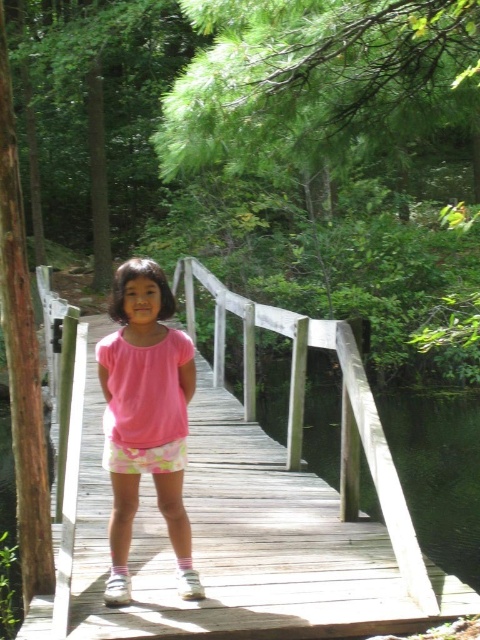
Question: In this image, where is wooden bridge at center located relative to transparent water at bridge right?

Choices:
 (A) right
 (B) left

Answer: (B)

Question: Which point is closer to the camera?

Choices:
 (A) transparent water at bridge right
 (B) pink cotton shirt at center

Answer: (B)

Question: Which point is closer to the camera?

Choices:
 (A) pink cotton shirt at center
 (B) wooden bridge at center
 (C) transparent water at bridge right

Answer: (B)

Question: Where is wooden bridge at center located in relation to pink cotton shirt at center in the image?

Choices:
 (A) below
 (B) above

Answer: (A)

Question: Which of the following is the farthest from the observer?

Choices:
 (A) wooden bridge at center
 (B) pink cotton shirt at center

Answer: (B)

Question: Does transparent water at bridge right appear over pink cotton shirt at center?

Choices:
 (A) yes
 (B) no

Answer: (B)